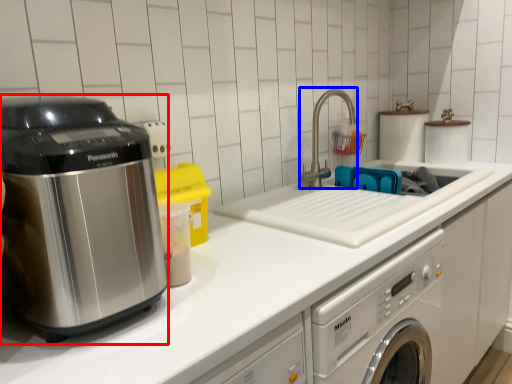
Question: Which object is further to the camera taking this photo, home appliance (highlighted by a red box) or faucet (highlighted by a blue box)?

Choices:
 (A) home appliance
 (B) faucet

Answer: (B)